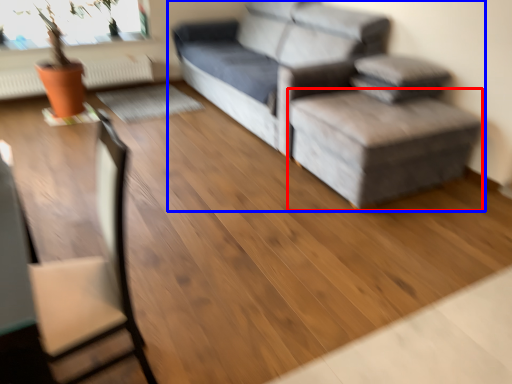
Question: Which of the following is the farthest to the observer, stool (highlighted by a red box) or studio couch (highlighted by a blue box)?

Choices:
 (A) stool
 (B) studio couch

Answer: (B)